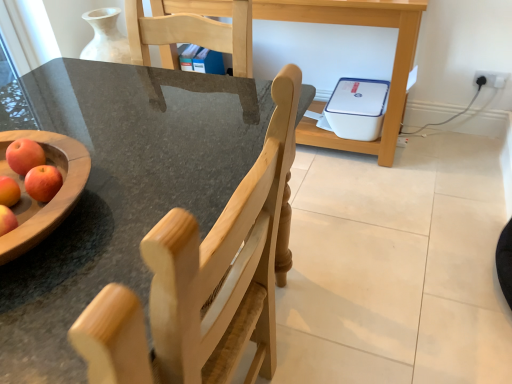
Question: Is white plastic printer at center to the left of red matte apple at left from the viewer's perspective?

Choices:
 (A) no
 (B) yes

Answer: (A)

Question: Is white plastic printer at center far away from red matte apple at left?

Choices:
 (A) no
 (B) yes

Answer: (B)

Question: Does white plastic printer at center have a smaller size compared to red matte apple at left?

Choices:
 (A) no
 (B) yes

Answer: (A)

Question: Is white plastic printer at center turned away from red matte apple at left?

Choices:
 (A) yes
 (B) no

Answer: (B)

Question: Does white plastic printer at center come behind red matte apple at left?

Choices:
 (A) no
 (B) yes

Answer: (B)

Question: Relative to natural wood chair at center, is white plastic printer at center in front or behind?

Choices:
 (A) behind
 (B) front

Answer: (A)

Question: Is white plastic printer at center bigger or smaller than natural wood chair at center?

Choices:
 (A) small
 (B) big

Answer: (B)

Question: Do you think white plastic printer at center is within natural wood chair at center, or outside of it?

Choices:
 (A) inside
 (B) outside

Answer: (B)

Question: In terms of width, does white plastic printer at center look wider or thinner when compared to natural wood chair at center?

Choices:
 (A) wide
 (B) thin

Answer: (A)

Question: In the image, is white plastic electric outlet at upper right positioned in front of or behind red matte apple at left?

Choices:
 (A) behind
 (B) front

Answer: (A)

Question: Considering the relative positions of white plastic electric outlet at upper right and red matte apple at left in the image provided, is white plastic electric outlet at upper right to the left or to the right of red matte apple at left?

Choices:
 (A) left
 (B) right

Answer: (B)

Question: From the image's perspective, relative to red matte apple at left, is white plastic electric outlet at upper right above or below?

Choices:
 (A) above
 (B) below

Answer: (A)

Question: Is white plastic electric outlet at upper right inside or outside of red matte apple at left?

Choices:
 (A) inside
 (B) outside

Answer: (B)

Question: In the image, is white plastic electric outlet at upper right positioned in front of or behind white plastic printer at center?

Choices:
 (A) behind
 (B) front

Answer: (A)

Question: In terms of size, does white plastic electric outlet at upper right appear bigger or smaller than white plastic printer at center?

Choices:
 (A) small
 (B) big

Answer: (A)